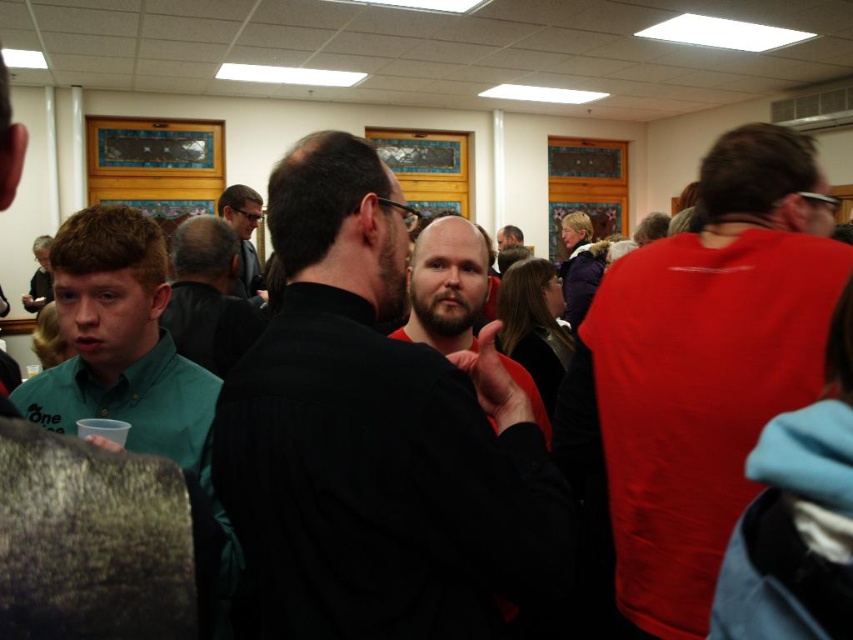
Is point (776, 376) positioned before point (503, 227)?

That is True.

The width and height of the screenshot is (853, 640). I want to click on matte red shirt at right, so click(x=700, y=369).

Is point (637, 464) farther from viewer compared to point (506, 241)?

No.

Locate an element on the screen. The height and width of the screenshot is (640, 853). matte red shirt at right is located at coordinates (700, 369).

Between matte red shirt at right and matte black shirt at left, which one has less height?

matte black shirt at left is shorter.

Can you confirm if matte red shirt at right is positioned above matte black shirt at left?

No, matte red shirt at right is not above matte black shirt at left.

I want to click on matte red shirt at right, so click(x=700, y=369).

Describe the element at coordinates (376, 436) in the screenshot. This screenshot has height=640, width=853. I see `black matte shirt at center` at that location.

Where is `black matte shirt at center`? Image resolution: width=853 pixels, height=640 pixels. black matte shirt at center is located at coordinates (376, 436).